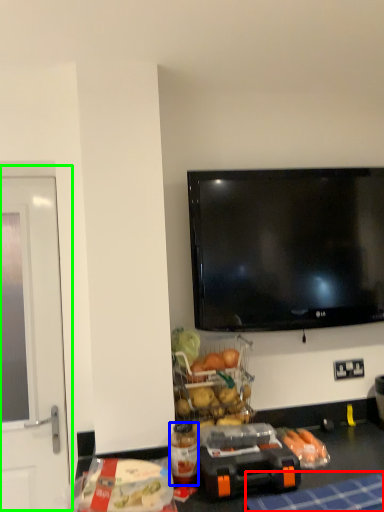
Question: Which object is positioned closest to tablecloth (highlighted by a red box)? Select from bottle (highlighted by a blue box) and screen door (highlighted by a green box).

Choices:
 (A) bottle
 (B) screen door

Answer: (A)